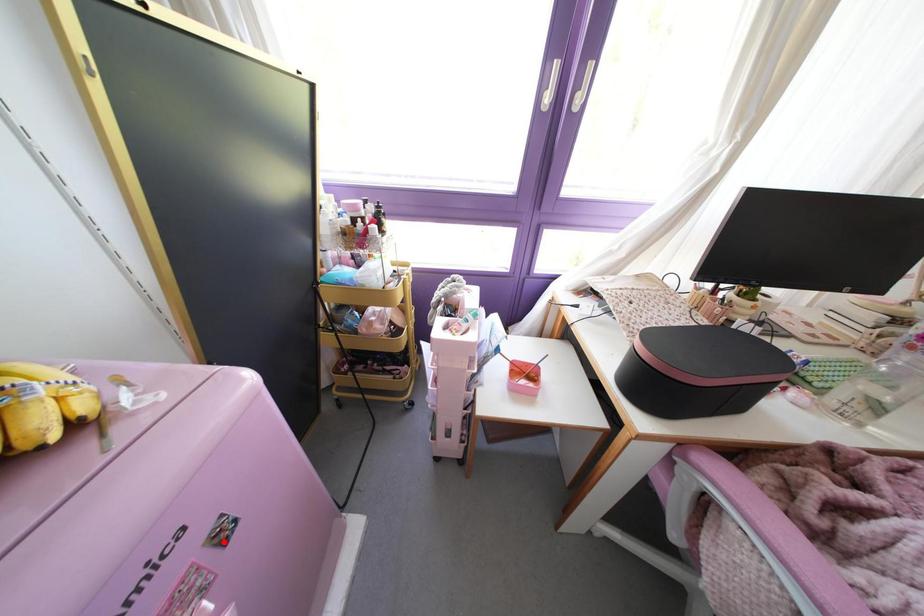
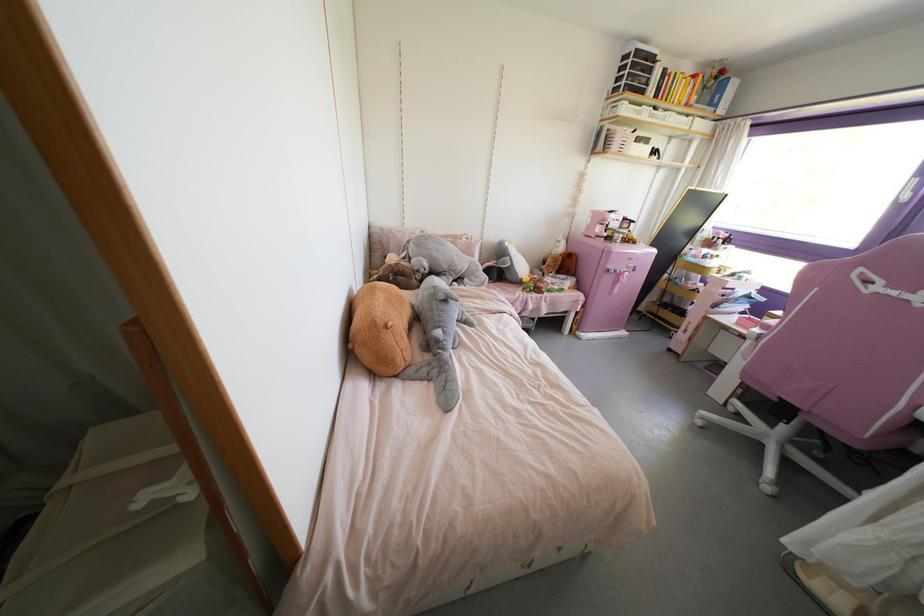
Question: I am providing you with two images of the same scene from different viewpoints. Given a red point in image1, look at the same physical point in image2. Is it:

Choices:
 (A) Closer to the viewpoint
 (B) Farther from the viewpoint

Answer: (A)